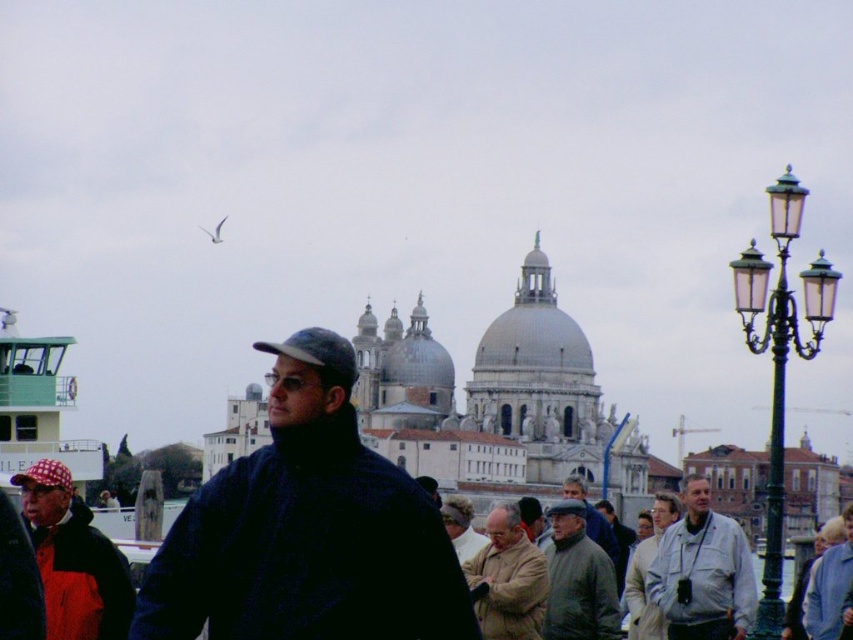
Question: Which object is the farthest from the gray woolen jacket at center?

Choices:
 (A) gray wool sweater at center
 (B) checkered fabric baseball cap at left

Answer: (B)

Question: Is light brown leather jacket at center wider than dark blue fabric baseball cap at center?

Choices:
 (A) no
 (B) yes

Answer: (A)

Question: Does green metal lamp post at right have a greater width compared to red checkered cap at lower left?

Choices:
 (A) no
 (B) yes

Answer: (B)

Question: Which of these objects is positioned closest to the red checkered cap at lower left?

Choices:
 (A) light gray jacket at center
 (B) green metal lamp post at right

Answer: (A)

Question: Can you confirm if green metal lamp post at right is wider than gray woolen jacket at center?

Choices:
 (A) yes
 (B) no

Answer: (A)

Question: Considering the real-world distances, which object is closest to the checkered fabric baseball cap at left?

Choices:
 (A) light gray jacket at center
 (B) gray wool sweater at center
 (C) light brown leather jacket at center
 (D) red checkered cap at lower left

Answer: (D)